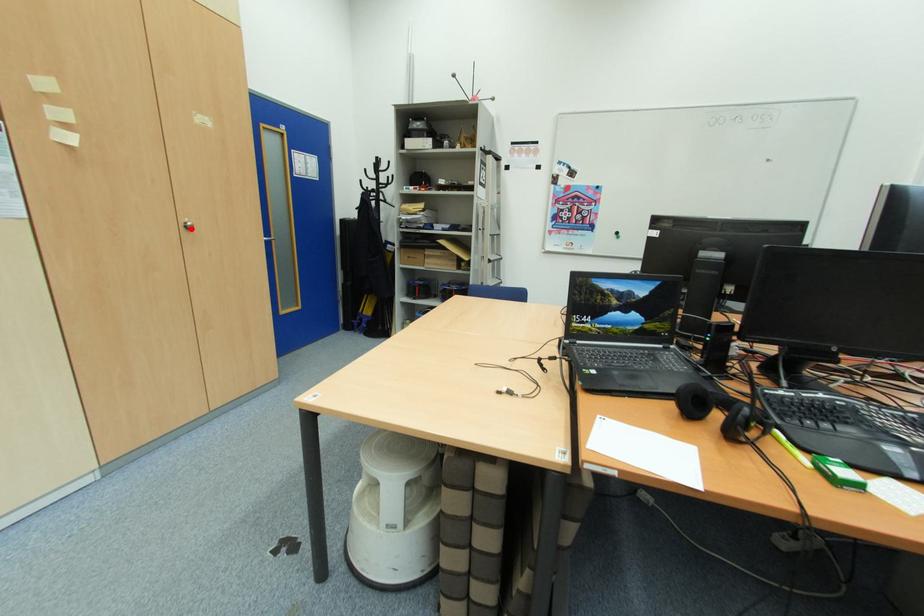
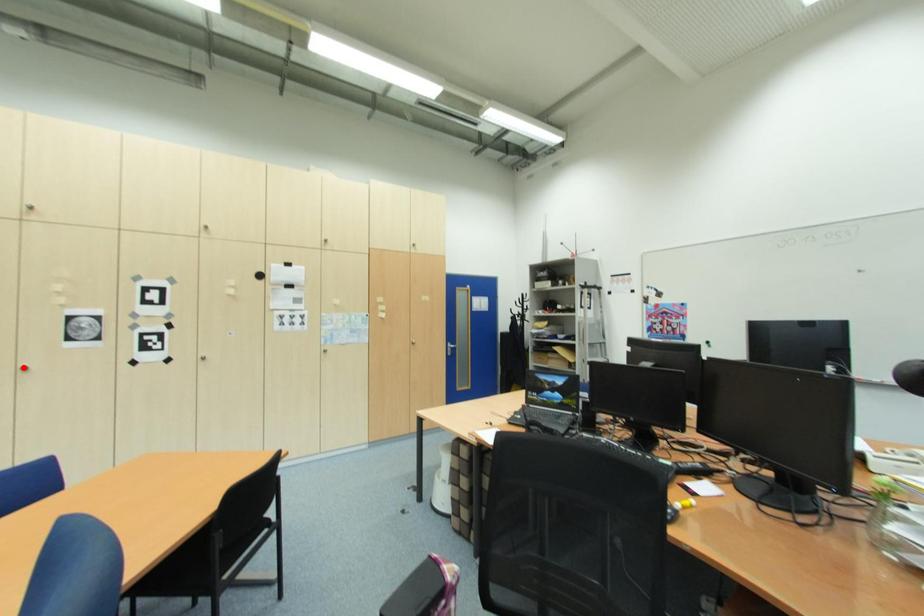
I am providing you with two images of the same scene from different viewpoints. A red point is marked on the first image and another point is marked on the second image. Do the highlighted points in image1 and image2 indicate the same real-world spot?

No